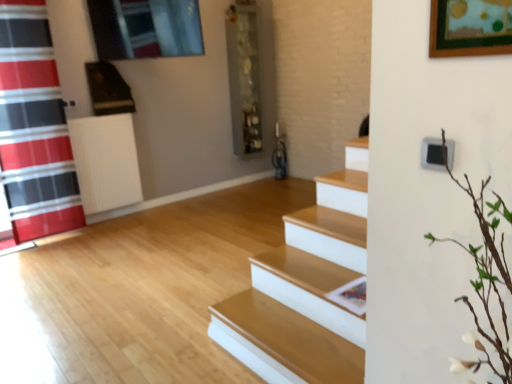
Find the location of a particular element. free point above white plastic radiator at left (from a real-world perspective) is located at coordinates (99, 115).